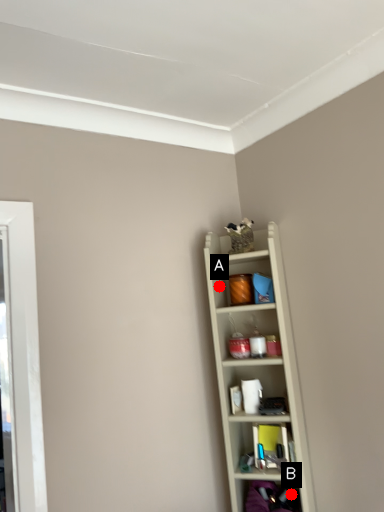
Question: Two points are circled on the image, labeled by A and B beside each circle. Which point is closer to the camera?

Choices:
 (A) A is closer
 (B) B is closer

Answer: (B)